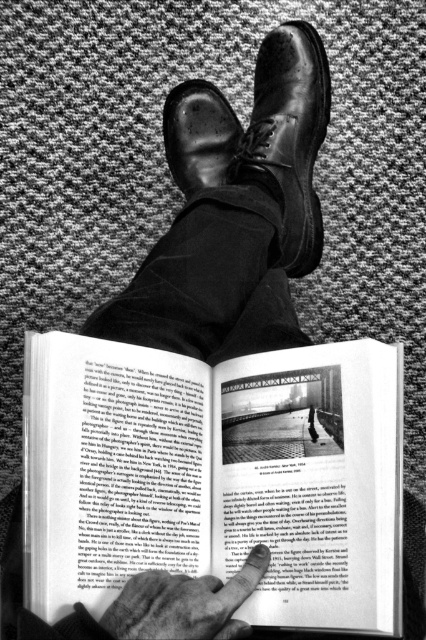
Based on the photo, can you confirm if matte paper book at center is taller than smooth skin finger at lower center?

Yes.

Who is positioned more to the left, matte paper book at center or smooth skin finger at lower center?

smooth skin finger at lower center

Is point (279, 445) positioned in front of point (149, 577)?

No, it is behind (149, 577).

The width and height of the screenshot is (426, 640). I want to click on matte paper book at center, so click(215, 476).

Who is higher up, shiny leather shoe at center or smooth skin finger at lower center?

Positioned higher is shiny leather shoe at center.

Is shiny leather shoe at center in front of smooth skin finger at lower center?

No.

Between point (204, 163) and point (236, 624), which one is positioned behind?

Positioned behind is point (204, 163).

At what (x,y) coordinates should I click in order to perform the action: click on shiny leather shoe at center. Please return your answer as a coordinate pair (x, y). This screenshot has width=426, height=640. Looking at the image, I should click on (261, 136).

Which of these two, matte paper book at center or shiny leather shoe at center, stands shorter?

matte paper book at center is shorter.

Does matte paper book at center appear on the right side of shiny leather shoe at center?

In fact, matte paper book at center is to the left of shiny leather shoe at center.

Is point (350, 358) more distant than point (308, 150)?

That is False.

Where is `matte paper book at center`? matte paper book at center is located at coordinates (215, 476).